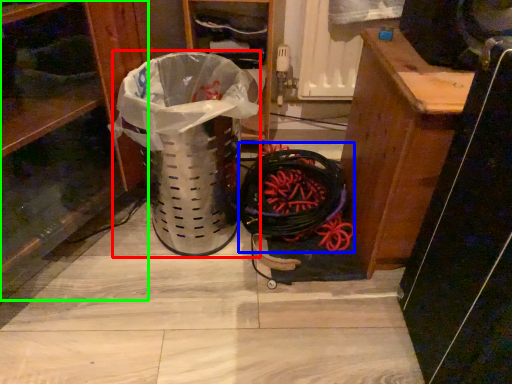
Question: Based on their relative distances, which object is nearer to garbage (highlighted by a red box)? Choose from battle rope (highlighted by a blue box) and shelf (highlighted by a green box).

Choices:
 (A) battle rope
 (B) shelf

Answer: (B)